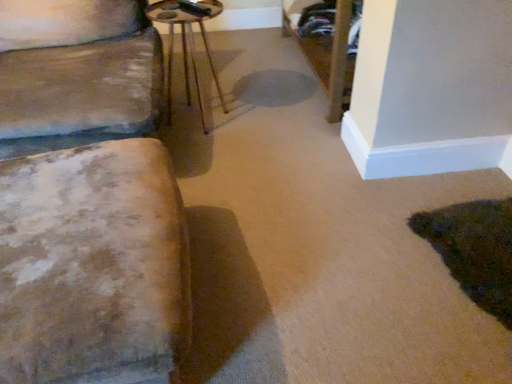
Find the location of a particular element. This screenshot has height=384, width=512. blank space above distressed fabric ottoman at left (from a real-world perspective) is located at coordinates (90, 219).